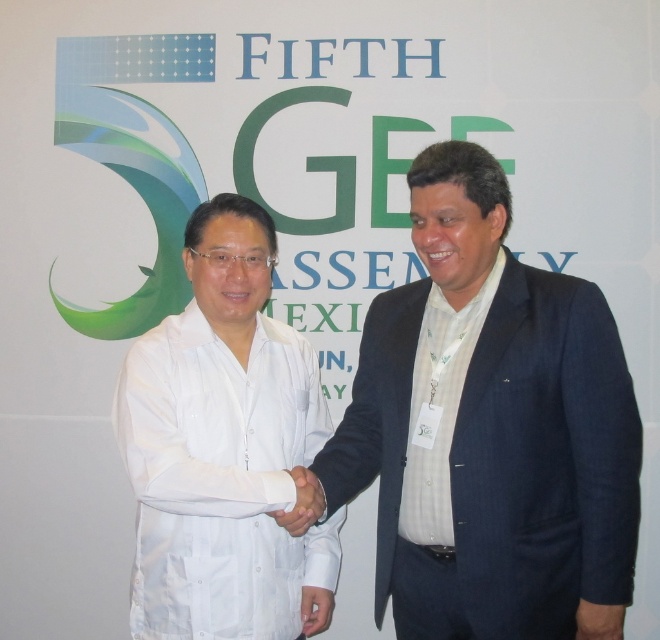
Question: Which object is closer to the camera taking this photo?

Choices:
 (A) dark blue suit at center
 (B) white matte shirt at center
 (C) white matte hand at center

Answer: (B)

Question: Does dark blue suit at center appear on the left side of white matte shirt at center?

Choices:
 (A) no
 (B) yes

Answer: (A)

Question: Which point appears closest to the camera in this image?

Choices:
 (A) (315, 509)
 (B) (601, 376)
 (C) (284, 392)

Answer: (B)

Question: Can you confirm if white matte shirt at center is positioned to the right of white matte hand at center?

Choices:
 (A) no
 (B) yes

Answer: (A)

Question: Which of the following is the farthest from the observer?

Choices:
 (A) white matte shirt at center
 (B) dark blue suit at center
 (C) white matte hand at center

Answer: (B)

Question: Can you confirm if white matte shirt at center is positioned below white matte hand at center?

Choices:
 (A) yes
 (B) no

Answer: (B)